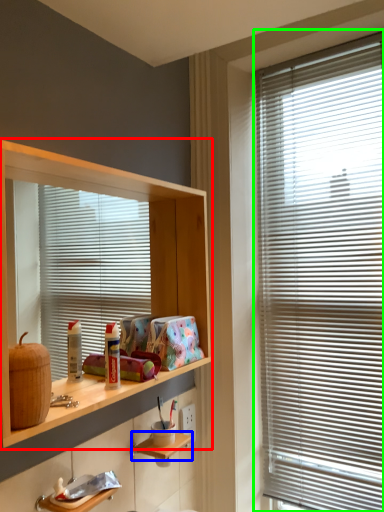
Question: Which object is the farthest from shelf (highlighted by a red box)? Choose among these: shelf (highlighted by a blue box) or window blind (highlighted by a green box).

Choices:
 (A) shelf
 (B) window blind

Answer: (A)